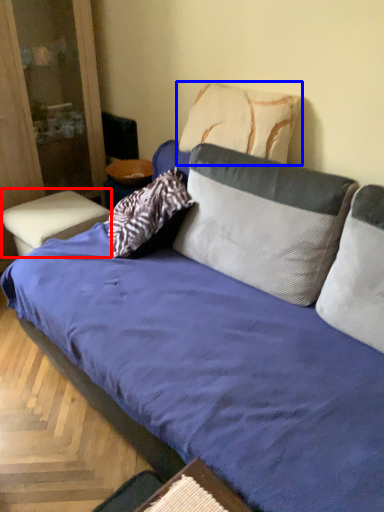
Question: Among these objects, which one is farthest to the camera, table (highlighted by a red box) or pillow (highlighted by a blue box)?

Choices:
 (A) table
 (B) pillow

Answer: (A)